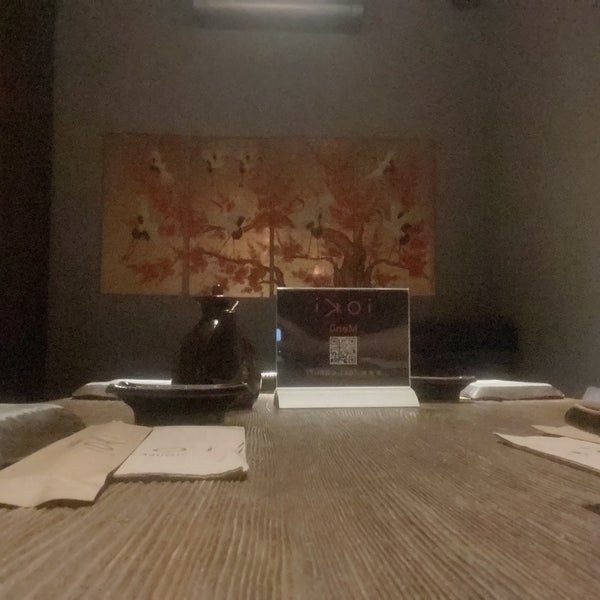
What are the coordinates of `empty wall above frame` in the screenshot? It's located at (281, 97).